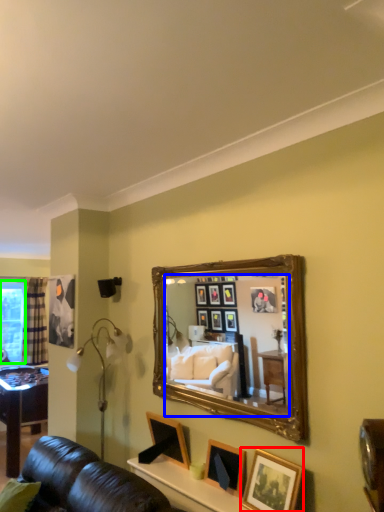
Question: Which is farther away from picture frame (highlighted by a red box)? mirror (highlighted by a blue box) or window screen (highlighted by a green box)?

Choices:
 (A) mirror
 (B) window screen

Answer: (B)